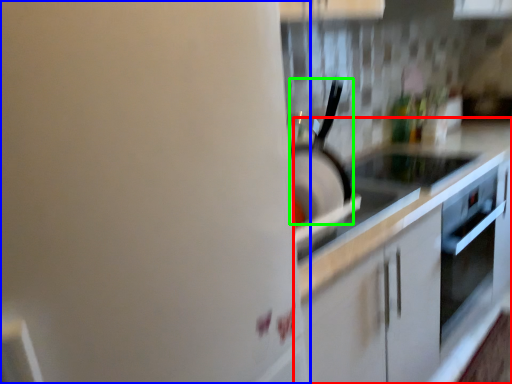
Question: Based on their relative distances, which object is nearer to countertop (highlighted by a red box)? Choose from home appliance (highlighted by a blue box) and kitchen appliance (highlighted by a green box).

Choices:
 (A) home appliance
 (B) kitchen appliance

Answer: (B)